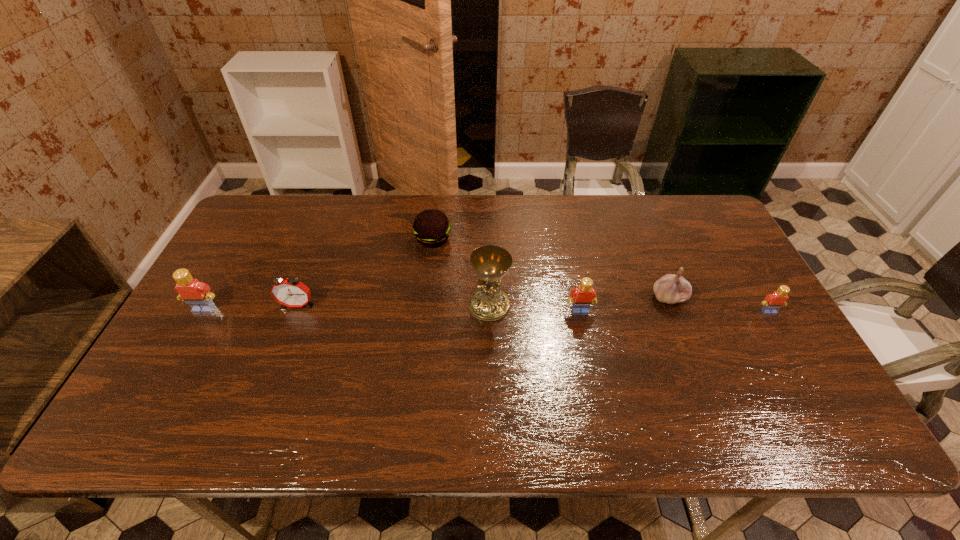
This screenshot has height=540, width=960. What are the coordinates of `the tallest Lego` in the screenshot? It's located at click(197, 294).

Identify the location of the leftmost object. The height and width of the screenshot is (540, 960). (197, 294).

Where is `the fifth object from left to right`? the fifth object from left to right is located at coordinates (584, 295).

Where is `the second shortest Lego`? This screenshot has height=540, width=960. the second shortest Lego is located at coordinates (x=584, y=295).

I want to click on the shortest Lego, so [x=774, y=301].

You are a GUI agent. You are given a task and a screenshot of the screen. Output one action in this format:
    pyautogui.click(x=<x>, y=<y>)
    Task: Click on the rightmost object
    
    Given the screenshot: What is the action you would take?
    pyautogui.click(x=774, y=301)

The image size is (960, 540). In order to click on the farthest object in this screenshot , I will do `click(431, 228)`.

Find the location of a particular element. Image resolution: width=960 pixels, height=540 pixels. patty is located at coordinates (431, 228).

Identify the location of the fourth object from left to right. (490, 262).

The image size is (960, 540). In order to click on chalice in this screenshot , I will do `click(490, 262)`.